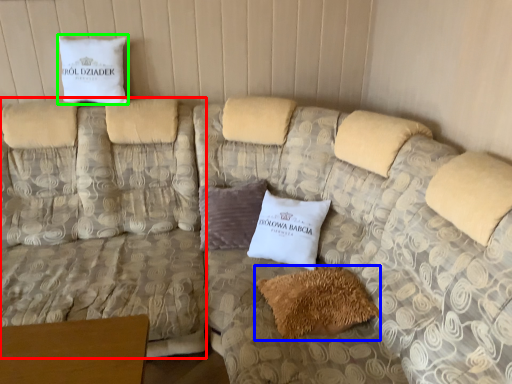
Question: Estimate the real-world distances between objects in this image. Which object is farther from couch (highlighted by a red box), pillow (highlighted by a blue box) or pillow (highlighted by a green box)?

Choices:
 (A) pillow
 (B) pillow

Answer: (A)